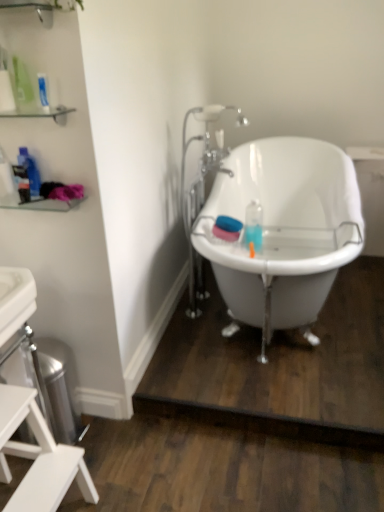
Question: Should I look upward or downward to see white glossy bathtub at center?

Choices:
 (A) down
 (B) up

Answer: (B)

Question: Can you confirm if white matte stool at lower left is positioned to the right of translucent plastic bottle at upper left, marked as the 2th bottle in a left-to-right arrangement?

Choices:
 (A) no
 (B) yes

Answer: (A)

Question: From a real-world perspective, does white matte stool at lower left sit lower than translucent plastic bottle at upper left, marked as the 2th bottle in a left-to-right arrangement?

Choices:
 (A) yes
 (B) no

Answer: (A)

Question: Does white matte stool at lower left have a smaller size compared to translucent plastic bottle at upper left, the first bottle viewed from the right?

Choices:
 (A) yes
 (B) no

Answer: (B)

Question: Can you confirm if white matte stool at lower left is wider than translucent plastic bottle at upper left, the first bottle viewed from the right?

Choices:
 (A) no
 (B) yes

Answer: (B)

Question: Is white matte stool at lower left to the left of translucent plastic bottle at upper left, marked as the 2th bottle in a left-to-right arrangement, from the viewer's perspective?

Choices:
 (A) no
 (B) yes

Answer: (B)

Question: Is white matte stool at lower left positioned far away from translucent plastic bottle at upper left, marked as the 2th bottle in a left-to-right arrangement?

Choices:
 (A) no
 (B) yes

Answer: (A)

Question: Can you confirm if translucent plastic bottle at upper left, the first bottle viewed from the right, is positioned to the right of blue matte mouthwash at center?

Choices:
 (A) yes
 (B) no

Answer: (B)

Question: Does translucent plastic bottle at upper left, marked as the 2th bottle in a left-to-right arrangement, have a lesser width compared to blue matte mouthwash at center?

Choices:
 (A) yes
 (B) no

Answer: (A)

Question: Can you confirm if translucent plastic bottle at upper left, the first bottle viewed from the right, is smaller than blue matte mouthwash at center?

Choices:
 (A) no
 (B) yes

Answer: (B)

Question: Does translucent plastic bottle at upper left, marked as the 2th bottle in a left-to-right arrangement, come behind blue matte mouthwash at center?

Choices:
 (A) no
 (B) yes

Answer: (A)

Question: Is translucent plastic bottle at upper left, the first bottle viewed from the right, far from blue matte mouthwash at center?

Choices:
 (A) yes
 (B) no

Answer: (B)

Question: Can you confirm if translucent plastic bottle at upper left, marked as the 2th bottle in a left-to-right arrangement, is wider than blue matte mouthwash at center?

Choices:
 (A) no
 (B) yes

Answer: (A)

Question: From a real-world perspective, does clear glass shelf at upper left stand above translucent plastic bottle at left, placed as the second bottle when sorted from right to left?

Choices:
 (A) yes
 (B) no

Answer: (A)